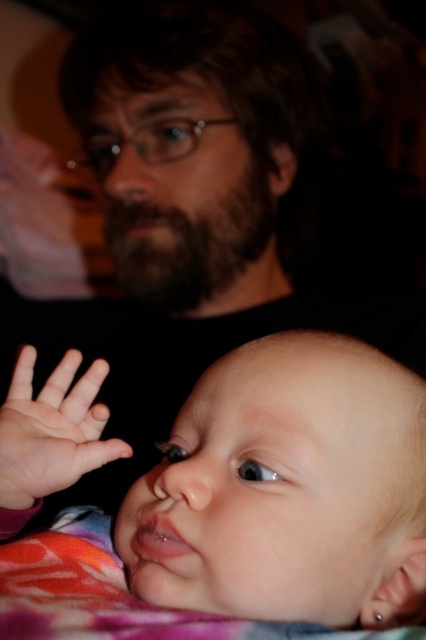
You are standing in front of the baby and want to place a sticker on one of the two points shown in the image. The first point is at coordinates point (92, 422) and the second is at point (169, 611). Which point is closer to the baby?

Point (169, 611) is closer to the baby because it is in front of point (92, 422).

You are a photographer setting up a studio for a baby photo shoot. You notice the fluffy pink blanket at lower left and the pink smooth skin at lower left in the scene. Which object is closer to the camera?

The pink smooth skin at lower left is closer to the camera because the fluffy pink blanket at lower left is positioned under it.

You are a photographer adjusting the focus on your camera. You want to capture a clear image of both the smooth skin baby at lower left and the pink smooth skin at lower left. Which one should you focus on first to ensure it appears sharp in the final photo?

You should focus on the smooth skin baby at lower left first because it is closer to the viewer than the pink smooth skin at lower left. Since objects closer to the camera require adjusting focus first, ensuring the baby is in focus will help achieve clarity for both subjects.